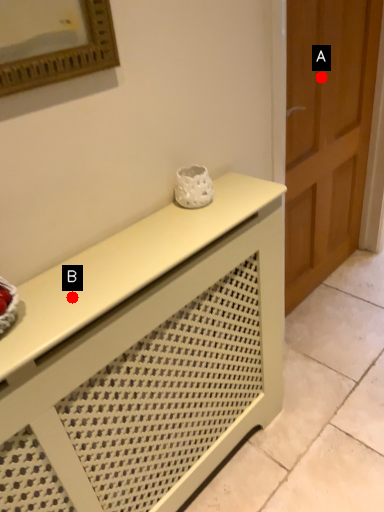
Question: Two points are circled on the image, labeled by A and B beside each circle. Among these points, which one is nearest to the camera?

Choices:
 (A) A is closer
 (B) B is closer

Answer: (B)